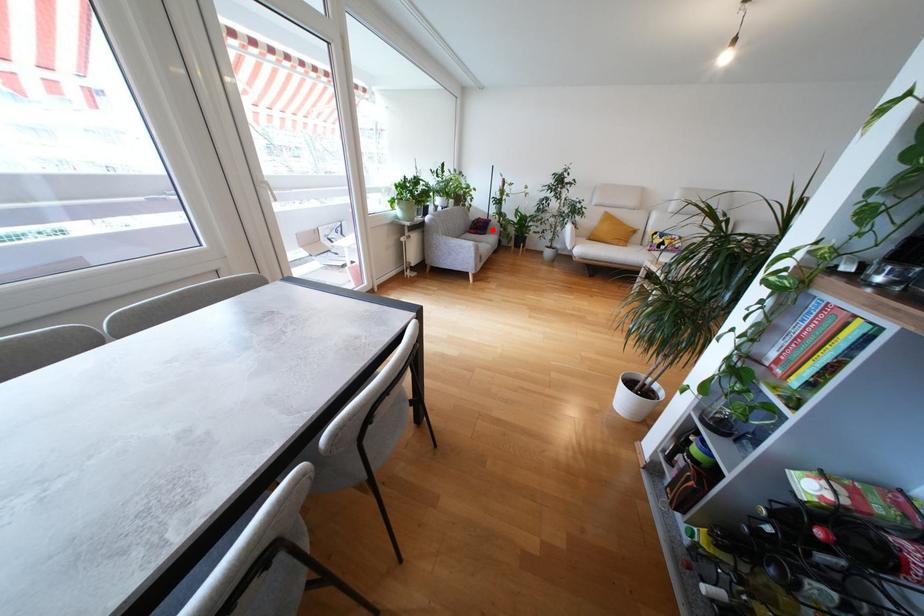
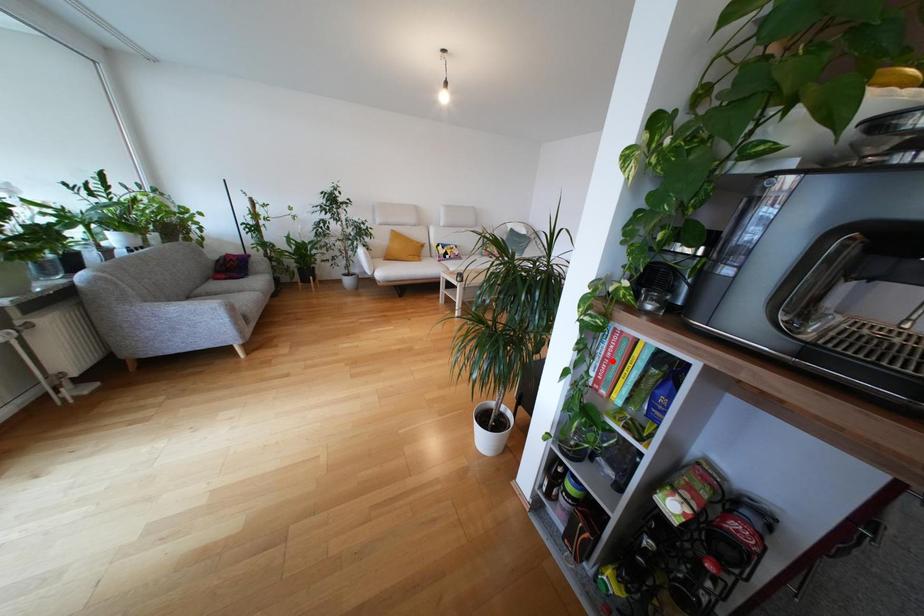
I am providing you with two images of the same scene from different viewpoints. A red point is marked on the first image and another point is marked on the second image. Are the points marked in image1 and image2 representing the same 3D position?

No